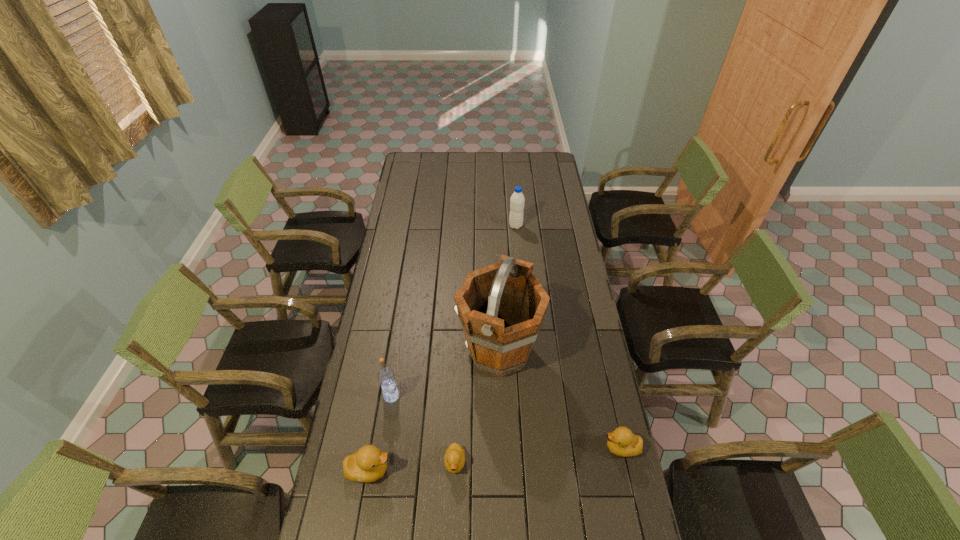
If the aim is uniform spacing by inserting an additional duckling among them, please point to a vacant space for this new duckling. Please provide its 2D coordinates. Your answer should be formatted as a tuple, i.e. [(x, y)], where the tuple contains the x and y coordinates of a point satisfying the conditions above.

[(540, 455)]